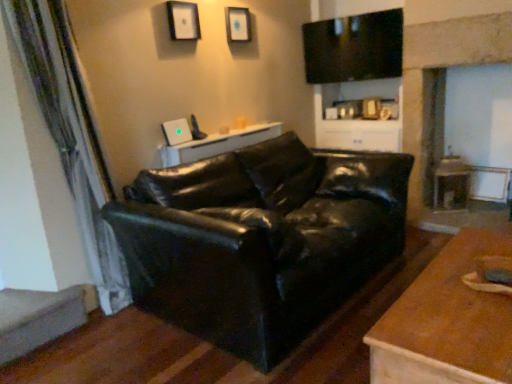
What is the approximate width of matte black entertainment center at upper center?

matte black entertainment center at upper center is 19.04 inches wide.

The width and height of the screenshot is (512, 384). What are the coordinates of `matte black picture frame at upper center, arranged as the 1th picture frame when viewed from the front` in the screenshot? It's located at (183, 20).

What do you see at coordinates (238, 24) in the screenshot?
I see `matte white picture frame at upper center, positioned as the 1th picture frame in back-to-front order` at bounding box center [238, 24].

How much space does white glossy table at center, placed as the second table when sorted from front to back, occupy vertically?

white glossy table at center, placed as the second table when sorted from front to back, is 1.48 inches tall.

Where is `black leather couch at center`? black leather couch at center is located at coordinates (260, 240).

Identify the location of table that appears above the wooden side table at right (from a real-world perspective). The height and width of the screenshot is (384, 512). (218, 144).

Which object is positioned more to the left, white glossy table at center, placed as the second table when sorted from front to back, or wooden side table at right?

white glossy table at center, placed as the second table when sorted from front to back, is more to the left.

Is white glossy table at center, arranged as the second table when viewed from the right, oriented towards wooden side table at right?

No, white glossy table at center, arranged as the second table when viewed from the right, is not oriented towards wooden side table at right.

In terms of height, does green textured curtain at left look taller or shorter compared to matte black entertainment center at upper center?

Clearly, green textured curtain at left is taller compared to matte black entertainment center at upper center.

The width and height of the screenshot is (512, 384). In order to click on curtain that is on the left side of matte black entertainment center at upper center in this screenshot , I will do `click(71, 135)`.

Does point (49, 90) come farther from viewer compared to point (376, 139)?

No.

Can you confirm if green textured curtain at left is positioned to the left of matte black entertainment center at upper center?

Indeed, green textured curtain at left is positioned on the left side of matte black entertainment center at upper center.

Is matte black entertainment center at upper center thinner than white glossy table at center, placed as the 1th table when sorted from top to bottom?

In fact, matte black entertainment center at upper center might be wider than white glossy table at center, placed as the 1th table when sorted from top to bottom.

Which table is the 2nd one when counting from the left side of the matte black entertainment center at upper center? Please provide its 2D coordinates.

[(218, 144)]

Considering the sizes of matte black entertainment center at upper center and white glossy table at center, the 1th table viewed from the back, in the image, is matte black entertainment center at upper center bigger or smaller than white glossy table at center, the 1th table viewed from the back,?

Considering their sizes, matte black entertainment center at upper center takes up more space than white glossy table at center, the 1th table viewed from the back.

Does matte black entertainment center at upper center appear on the left side of white glossy table at center, placed as the second table when sorted from front to back?

Incorrect, matte black entertainment center at upper center is not on the left side of white glossy table at center, placed as the second table when sorted from front to back.

Considering the relative sizes of green textured curtain at left and matte white picture frame at upper center, the second picture frame viewed from the front, in the image provided, is green textured curtain at left wider than matte white picture frame at upper center, the second picture frame viewed from the front,?

Correct, the width of green textured curtain at left exceeds that of matte white picture frame at upper center, the second picture frame viewed from the front.

Is point (33, 68) behind point (228, 14)?

No, it is in front of (228, 14).

Is green textured curtain at left not close to matte white picture frame at upper center, positioned as the 1th picture frame in back-to-front order?

Yes, green textured curtain at left is far from matte white picture frame at upper center, positioned as the 1th picture frame in back-to-front order.

Looking at this image, measure the distance from wooden coffee table at lower right, the 2th table viewed from the top, to matte white picture frame at upper center, the second picture frame viewed from the front.

The distance of wooden coffee table at lower right, the 2th table viewed from the top, from matte white picture frame at upper center, the second picture frame viewed from the front, is 8.24 feet.

From the image's perspective, count 2nd picture frames upward from the wooden coffee table at lower right, placed as the second table when sorted from left to right, and point to it. Please provide its 2D coordinates.

[(238, 24)]

Is wooden coffee table at lower right, placed as the second table when sorted from left to right, turned away from matte white picture frame at upper center, the first picture frame when ordered from right to left?

wooden coffee table at lower right, placed as the second table when sorted from left to right, is not turned away from matte white picture frame at upper center, the first picture frame when ordered from right to left.

Is wooden side table at right in front of or behind wooden coffee table at lower right, the first table when ordered from bottom to top, in the image?

In the image, wooden side table at right appears behind wooden coffee table at lower right, the first table when ordered from bottom to top.

From the image's perspective, is wooden side table at right on wooden coffee table at lower right, the first table when ordered from bottom to top?

Indeed, from the image's perspective, wooden side table at right is shown above wooden coffee table at lower right, the first table when ordered from bottom to top.

Which of these two, wooden side table at right or wooden coffee table at lower right, which is the first table from front to back, stands taller?

Standing taller between the two is wooden side table at right.

From a real-world perspective, is wooden side table at right located beneath wooden coffee table at lower right, placed as the second table when sorted from left to right?

No, from a real-world perspective, wooden side table at right is not beneath wooden coffee table at lower right, placed as the second table when sorted from left to right.

Is the depth of matte black picture frame at upper center, arranged as the 1th picture frame when viewed from the front, greater than that of matte white picture frame at upper center, the second picture frame viewed from the front?

No, it is not.

Find the location of a particular element. This screenshot has height=384, width=512. picture frame behind the matte black picture frame at upper center, which is the 1th picture frame from left to right is located at coordinates (238, 24).

Is matte black picture frame at upper center, marked as the second picture frame in a back-to-front arrangement, bigger than matte white picture frame at upper center, positioned as the 1th picture frame in back-to-front order?

No, matte black picture frame at upper center, marked as the second picture frame in a back-to-front arrangement, is not bigger than matte white picture frame at upper center, positioned as the 1th picture frame in back-to-front order.

Does matte black picture frame at upper center, which is the 1th picture frame from left to right, have a greater width compared to matte white picture frame at upper center, marked as the second picture frame in a left-to-right arrangement?

Incorrect, the width of matte black picture frame at upper center, which is the 1th picture frame from left to right, does not surpass that of matte white picture frame at upper center, marked as the second picture frame in a left-to-right arrangement.

Where is `side table that appears on the right of white glossy table at center, positioned as the 1th table in left-to-right order`? side table that appears on the right of white glossy table at center, positioned as the 1th table in left-to-right order is located at coordinates (451, 184).

Locate an element on the screen. The image size is (512, 384). curtain on the left side of matte black entertainment center at upper center is located at coordinates pyautogui.click(x=71, y=135).

When comparing their distances from green textured curtain at left, does wooden side table at right or matte black entertainment center at upper center seem further?

wooden side table at right lies further to green textured curtain at left than the other object.

From the image, which object appears to be farther from matte black picture frame at upper center, the 2th picture frame viewed from the right, green textured curtain at left or matte white picture frame at upper center, the first picture frame when ordered from right to left?

green textured curtain at left is positioned further to the anchor matte black picture frame at upper center, the 2th picture frame viewed from the right.

When comparing their distances from black leather couch at center, does matte black picture frame at upper center, which is the 1th picture frame from left to right, or matte black entertainment center at upper center seem closer?

matte black picture frame at upper center, which is the 1th picture frame from left to right, is closer to black leather couch at center.

Estimate the real-world distances between objects in this image. Which object is further from green textured curtain at left, wooden side table at right or matte white picture frame at upper center, marked as the second picture frame in a left-to-right arrangement?

wooden side table at right is further to green textured curtain at left.

From the picture: Based on their spatial positions, is wooden coffee table at lower right, which appears as the first table when viewed from the right, or matte black picture frame at upper center, the 2th picture frame viewed from the right, closer to green textured curtain at left?

Among the two, matte black picture frame at upper center, the 2th picture frame viewed from the right, is located nearer to green textured curtain at left.

When comparing their distances from matte black picture frame at upper center, the 2th picture frame viewed from the right, does green textured curtain at left or white glossy table at center, the 1th table viewed from the back, seem further?

Based on the image, green textured curtain at left appears to be further to matte black picture frame at upper center, the 2th picture frame viewed from the right.

When comparing their distances from matte black entertainment center at upper center, does wooden coffee table at lower right, placed as the second table when sorted from left to right, or matte white picture frame at upper center, positioned as the 1th picture frame in back-to-front order, seem closer?

matte white picture frame at upper center, positioned as the 1th picture frame in back-to-front order, is closer to matte black entertainment center at upper center.

Estimate the real-world distances between objects in this image. Which object is closer to matte black entertainment center at upper center, matte black picture frame at upper center, which is the 1th picture frame from left to right, or black leather couch at center?

matte black picture frame at upper center, which is the 1th picture frame from left to right.

Find the location of a particular element. This screenshot has height=384, width=512. picture frame situated between white glossy table at center, the 1th table viewed from the back, and wooden side table at right from left to right is located at coordinates (238, 24).

At what (x,y) coordinates should I click in order to perform the action: click on table between black leather couch at center and matte white picture frame at upper center, marked as the second picture frame in a left-to-right arrangement, from front to back. Please return your answer as a coordinate pair (x, y). Image resolution: width=512 pixels, height=384 pixels. Looking at the image, I should click on (218, 144).

The height and width of the screenshot is (384, 512). Identify the location of table positioned between wooden coffee table at lower right, which is the first table from front to back, and matte black entertainment center at upper center from near to far. (218, 144).

The width and height of the screenshot is (512, 384). Identify the location of table between matte black picture frame at upper center, which is the 1th picture frame from left to right, and green textured curtain at left from top to bottom. click(218, 144).